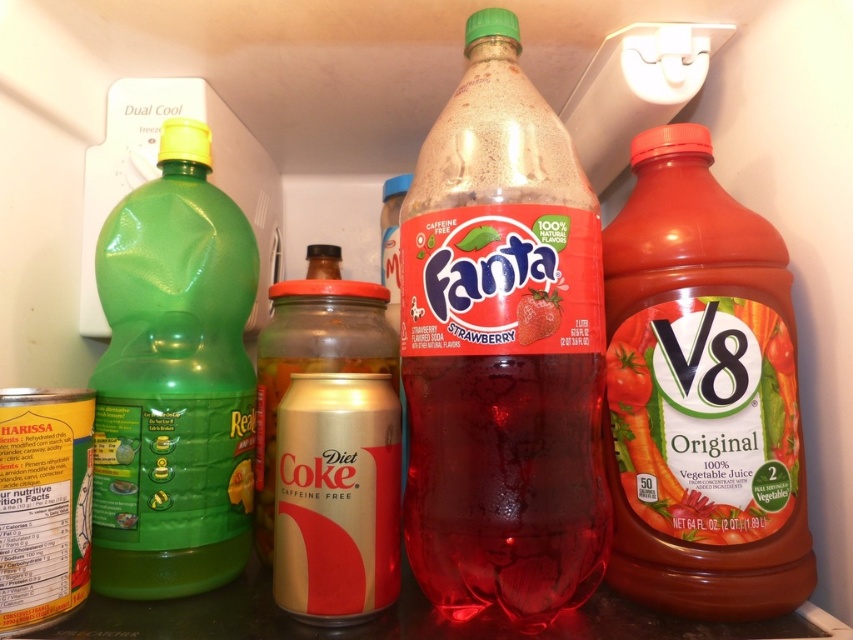
Question: Which point is farther to the camera?

Choices:
 (A) [677, 332]
 (B) [532, 554]
 (C) [669, 522]

Answer: (A)

Question: Does matte plastic v8 juice at right have a greater width compared to green plastic bottle at left?

Choices:
 (A) yes
 (B) no

Answer: (A)

Question: Which point is farther to the camera?

Choices:
 (A) strawberry-flavored soda at center
 (B) green plastic bottle at left
 (C) translucent plastic bottle at center
 (D) matte plastic v8 juice at right

Answer: (B)

Question: Considering the relative positions of matte plastic v8 juice at right and strawberry-flavored soda at center in the image provided, where is matte plastic v8 juice at right located with respect to strawberry-flavored soda at center?

Choices:
 (A) right
 (B) left

Answer: (A)

Question: Which point appears farthest from the camera in this image?

Choices:
 (A) (521, 323)
 (B) (204, 544)
 (C) (728, 413)

Answer: (B)

Question: Is translucent plastic bottle at center positioned in front of strawberry-flavored soda at center?

Choices:
 (A) yes
 (B) no

Answer: (A)